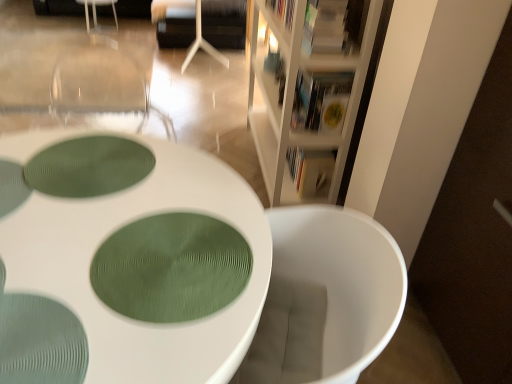
Identify the location of free space to the back side of green textured oval at center, which ranks as the second oval in top-to-bottom order. This screenshot has width=512, height=384. (173, 187).